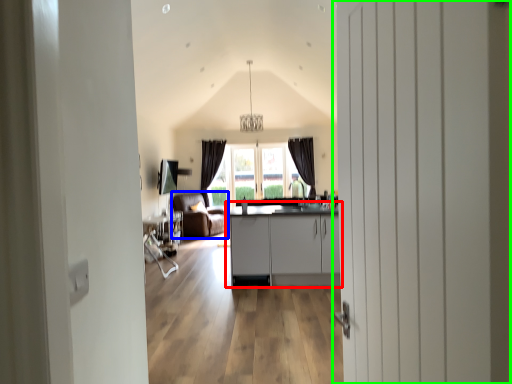
Question: Based on their relative distances, which object is farther from cabinetry (highlighted by a red box)? Choose from armchair (highlighted by a blue box) and door (highlighted by a green box).

Choices:
 (A) armchair
 (B) door

Answer: (B)